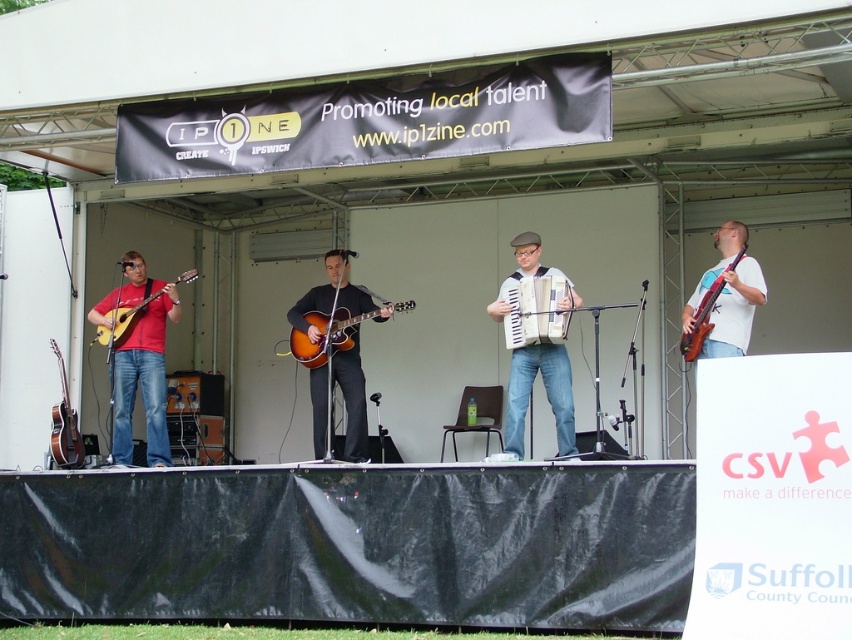
Is matte black guitar at center shorter than brown wooden electric guitar at right?

Yes.

Locate an element on the screen. matte black guitar at center is located at coordinates (429, 337).

Image resolution: width=852 pixels, height=640 pixels. Find the location of `matte black guitar at center`. matte black guitar at center is located at coordinates (429, 337).

Who is higher up, matte black accordion at center or matte brown accordion at center?

matte brown accordion at center is above.

Is matte black accordion at center closer to the viewer compared to matte brown accordion at center?

No, it is behind matte brown accordion at center.

Is point (527, 378) in front of point (544, 300)?

No, (527, 378) is behind (544, 300).

Locate an element on the screen. The image size is (852, 640). matte black accordion at center is located at coordinates (545, 392).

Is point (352, 406) positioned after point (531, 328)?

Yes, it is behind point (531, 328).

Locate an element on the screen. matte brown guitar at center is located at coordinates (332, 296).